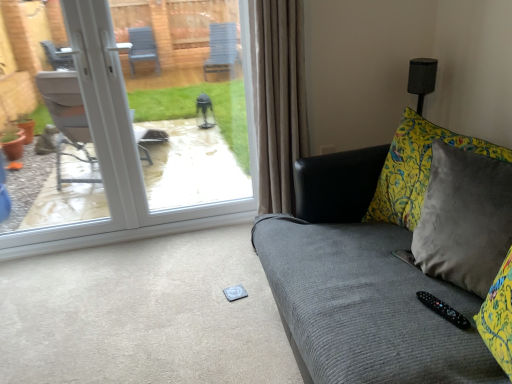
The image size is (512, 384). Identify the location of black plastic remote at lower right. (443, 310).

Where is `velvet gray couch at right`? velvet gray couch at right is located at coordinates (369, 269).

At what (x,y) coordinates should I click in order to perform the action: click on white plastic door at upper left. Please return your answer as a coordinate pair (x, y). Looking at the image, I should click on (147, 127).

This screenshot has height=384, width=512. What do you see at coordinates (147, 127) in the screenshot?
I see `white plastic door at upper left` at bounding box center [147, 127].

What are the coordinates of `black plastic remote at lower right` in the screenshot? It's located at (443, 310).

What's the angular difference between velvet gray couch at right and black plastic remote at lower right's facing directions?

They differ by 19.7 degrees in their facing directions.

Can you confirm if velvet gray couch at right is taller than black plastic remote at lower right?

Indeed, velvet gray couch at right has a greater height compared to black plastic remote at lower right.

Considering the sizes of objects velvet gray couch at right and black plastic remote at lower right in the image provided, who is thinner, velvet gray couch at right or black plastic remote at lower right?

Thinner between the two is black plastic remote at lower right.

Identify the location of studio couch on the left of black plastic remote at lower right. This screenshot has width=512, height=384. (369, 269).

Are white plastic door at upper left and black plastic remote at lower right located far from each other?

white plastic door at upper left is far away from black plastic remote at lower right.

Which point is more forward, (x=180, y=199) or (x=435, y=305)?

The point (x=435, y=305) is in front.

Looking at this image, is black plastic remote at lower right located within white plastic door at upper left?

No, black plastic remote at lower right is located outside of white plastic door at upper left.

Is white plastic door at upper left oriented away from black plastic remote at lower right?

No.

Is white plastic door at upper left looking in the opposite direction of velvet gray couch at right?

No, white plastic door at upper left's orientation is not away from velvet gray couch at right.

Is point (135, 60) closer or farther from the camera than point (439, 357)?

Clearly, point (135, 60) is more distant from the camera than point (439, 357).

From a real-world perspective, which is physically above, white plastic door at upper left or velvet gray couch at right?

In real-world perspective, white plastic door at upper left is above.

Does white plastic door at upper left have a lesser width compared to velvet gray couch at right?

Correct, the width of white plastic door at upper left is less than that of velvet gray couch at right.

Between point (344, 195) and point (92, 111), which one is positioned behind?

The point (92, 111) is more distant.

Does velvet gray couch at right contain white plastic door at upper left?

That's incorrect, white plastic door at upper left is not inside velvet gray couch at right.

Considering the relative positions of velvet gray couch at right and white plastic door at upper left in the image provided, is velvet gray couch at right behind white plastic door at upper left?

No, it is in front of white plastic door at upper left.

Between velvet gray couch at right and white plastic door at upper left, which one appears on the right side from the viewer's perspective?

From the viewer's perspective, velvet gray couch at right appears more on the right side.

Is black plastic remote at lower right beside velvet gray couch at right?

Answer: No, black plastic remote at lower right is not in contact with velvet gray couch at right.

Consider the image. Choose the correct answer: Is black plastic remote at lower right inside velvet gray couch at right or outside it?

black plastic remote at lower right is located inside velvet gray couch at right.

How different are the orientations of black plastic remote at lower right and velvet gray couch at right in degrees?

The facing directions of black plastic remote at lower right and velvet gray couch at right are 19.7 degrees apart.

Based on the photo, considering their positions, is black plastic remote at lower right located in front of or behind velvet gray couch at right?

Visually, black plastic remote at lower right is located behind velvet gray couch at right.

From a real-world perspective, between black plastic remote at lower right and white plastic door at upper left, who is vertically higher?

white plastic door at upper left.

Is black plastic remote at lower right positioned beyond the bounds of white plastic door at upper left?

Yes, black plastic remote at lower right is located beyond the bounds of white plastic door at upper left.

Identify the location of door above the black plastic remote at lower right (from a real-world perspective). The image size is (512, 384). (147, 127).

Identify the location of remote positioned vertically above the velvet gray couch at right (from a real-world perspective). (443, 310).

Identify the location of remote below the white plastic door at upper left (from a real-world perspective). The width and height of the screenshot is (512, 384). (443, 310).

Looking at the image, which one is located further to black plastic remote at lower right, velvet gray couch at right or white plastic door at upper left?

white plastic door at upper left is positioned further to the anchor black plastic remote at lower right.

From the image, which object appears to be farther from white plastic door at upper left, velvet gray couch at right or black plastic remote at lower right?

Based on the image, black plastic remote at lower right appears to be further to white plastic door at upper left.

Looking at the image, which one is located closer to velvet gray couch at right, white plastic door at upper left or black plastic remote at lower right?

The object closer to velvet gray couch at right is black plastic remote at lower right.

Looking at the image, which one is located closer to white plastic door at upper left, black plastic remote at lower right or velvet gray couch at right?

velvet gray couch at right is positioned closer to the anchor white plastic door at upper left.

Considering their positions, is white plastic door at upper left positioned further to black plastic remote at lower right than velvet gray couch at right?

white plastic door at upper left lies further to black plastic remote at lower right than the other object.

Looking at the image, which one is located further to velvet gray couch at right, black plastic remote at lower right or white plastic door at upper left?

white plastic door at upper left is positioned further to the anchor velvet gray couch at right.

Where is `studio couch between white plastic door at upper left and black plastic remote at lower right from left to right`? This screenshot has height=384, width=512. studio couch between white plastic door at upper left and black plastic remote at lower right from left to right is located at coordinates (369, 269).